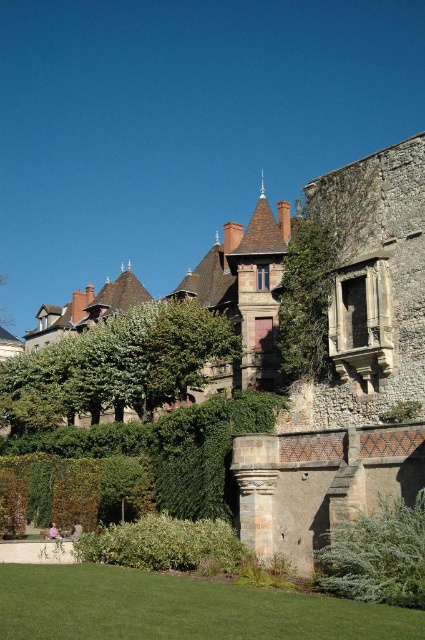
Question: Which of the following is the closest to the observer?

Choices:
 (A) pos(215,561)
 (B) pos(200,353)
 (C) pos(353,250)

Answer: (A)

Question: Is brown stone castle at upper center bigger than green grass at lower center?

Choices:
 (A) no
 (B) yes

Answer: (B)

Question: Which point is closer to the camera?

Choices:
 (A) green leafy hedge at center
 (B) green leafy hedge at lower right

Answer: (B)

Question: Does green grass at lower center appear on the right side of green leafy hedge at lower center?

Choices:
 (A) yes
 (B) no

Answer: (A)

Question: Among these points, which one is farthest from the camera?

Choices:
 (A) (84, 547)
 (B) (153, 346)
 (C) (348, 612)
 (D) (353, 269)

Answer: (B)

Question: In this image, where is brown stone castle at upper center located relative to green grass at lower center?

Choices:
 (A) below
 (B) above

Answer: (B)